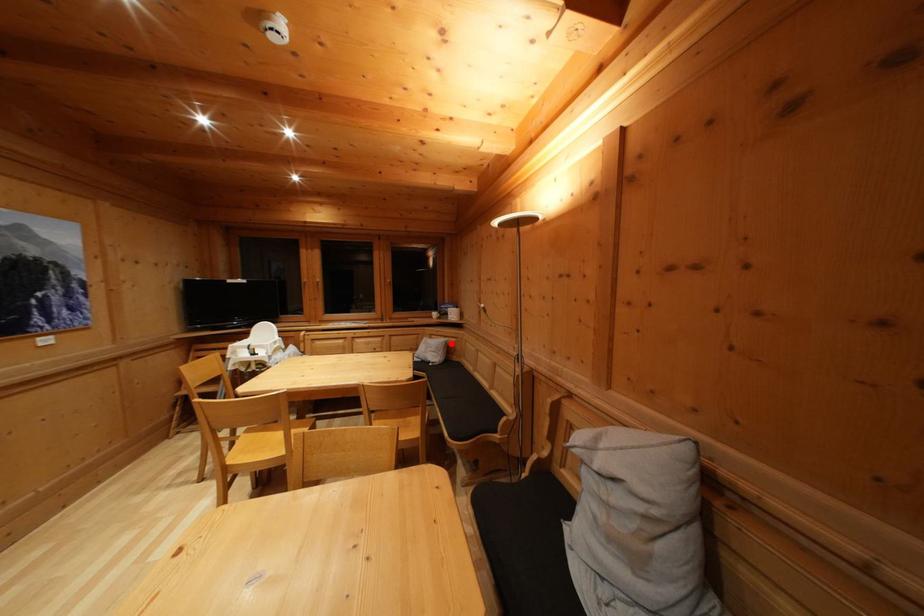
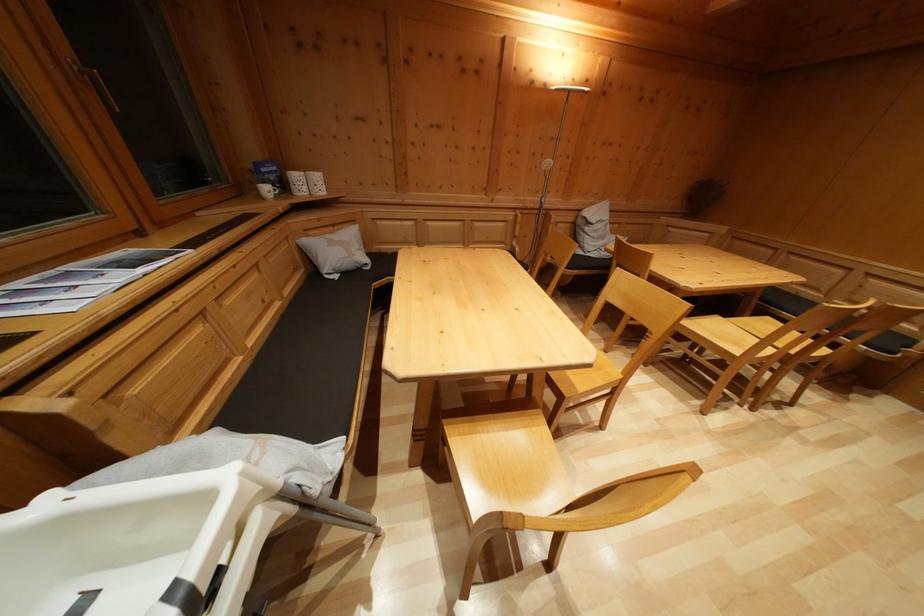
Question: I am providing you with two images of the same scene from different viewpoints. Image1 has a red point marked. In image2, the corresponding 3D location appears at what relative position? Reply with the corresponding letter.

Choices:
 (A) Closer
 (B) Farther

Answer: (A)